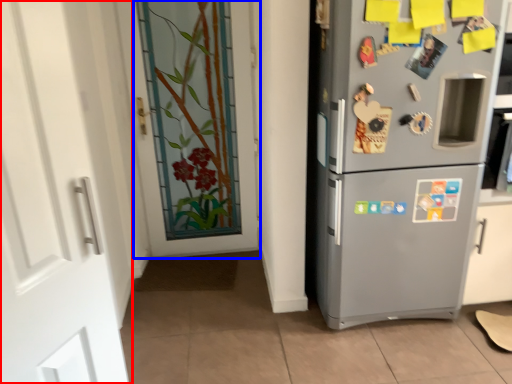
Question: Among these objects, which one is nearest to the camera, door (highlighted by a red box) or door (highlighted by a blue box)?

Choices:
 (A) door
 (B) door

Answer: (A)